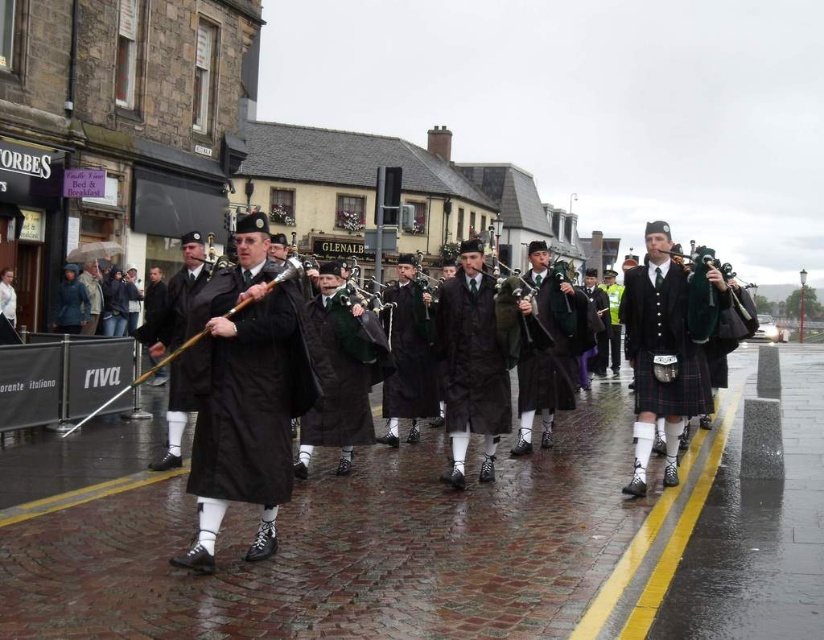
You are a photographer trying to capture the pipers marching down the wet street. You notice a dark brown leather coat at center. Where exactly is the dark brown leather coat positioned in relation to the pipers?

The dark brown leather coat at center is located at point coordinates of 0.553 on the x axis and 0.576 on the y axis, so it is positioned centrally in the image.

You are a photographer positioned at the center of the street, aiming to capture the plaid fabric kilt at right. Given the coordinates provided in the description, can you estimate whether this kilt is positioned to the left or right of the center of the image?

The plaid fabric kilt at right is located at point (667, 346), which places it to the right side of the image center based on standard coordinate systems where the origin is at the bottom left corner. Therefore, the kilt is positioned to the right of the center.

You are a photographer trying to capture the pipers in the image. You want to ensure that both the plaid fabric kilt at right and the green matte bagpipe at center are clearly visible in your shot. Since you have a limited frame width, which object should you prioritize framing first to ensure it fits, and why?

The plaid fabric kilt at right is wider than the green matte bagpipe at center. Therefore, you should prioritize framing the plaid fabric kilt at right first to ensure it fits within the limited frame width.